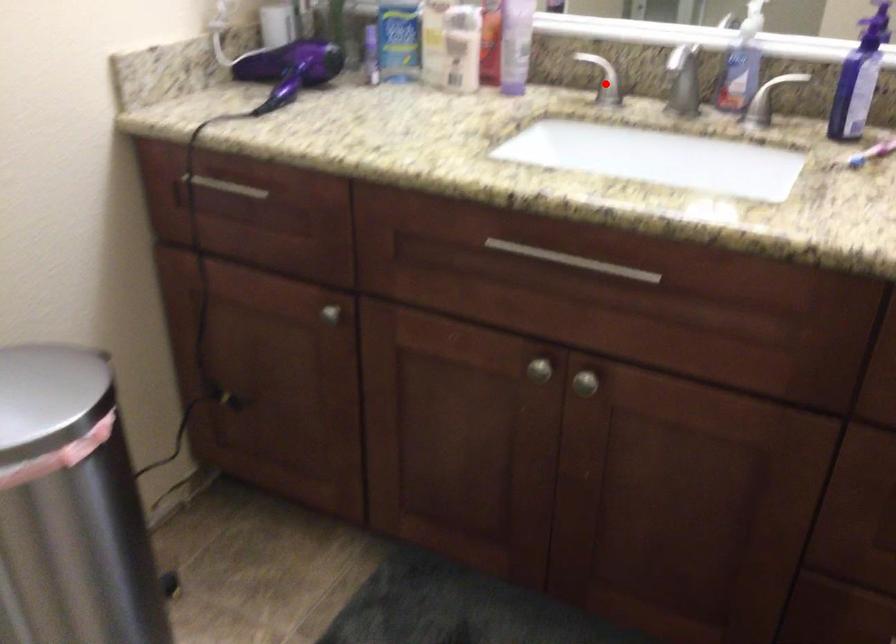
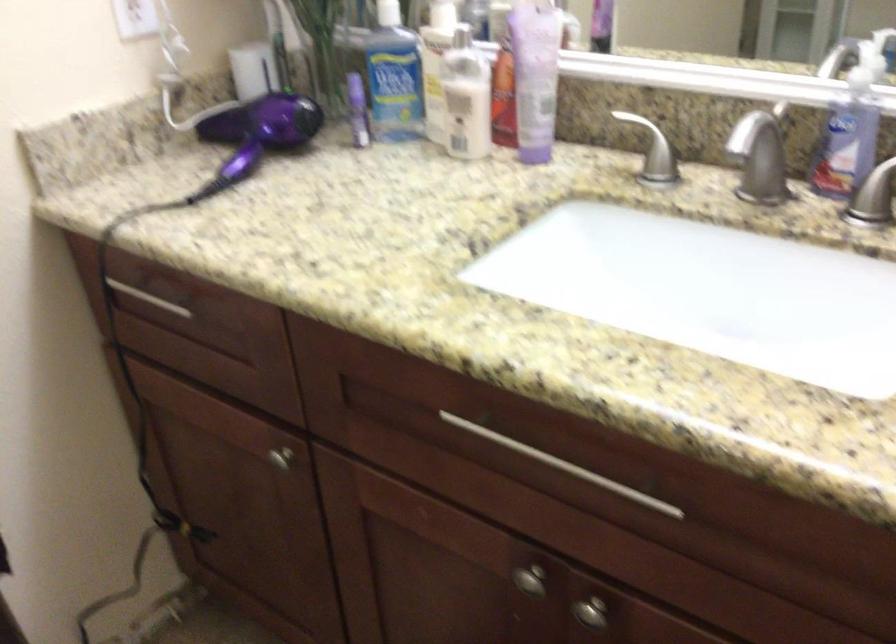
Find the pixel in the second image that matches the highlighted location in the first image.

(651, 149)